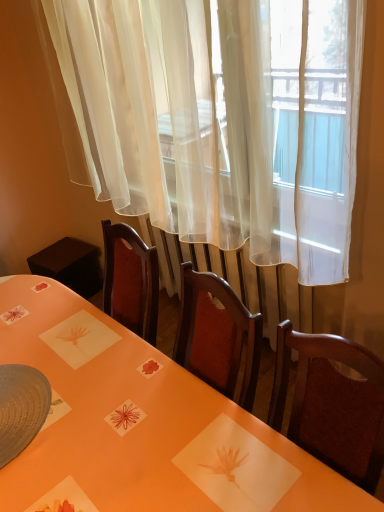
Identify the location of empty space that is ontop of orange glossy table at center (from a real-world perspective). (105, 392).